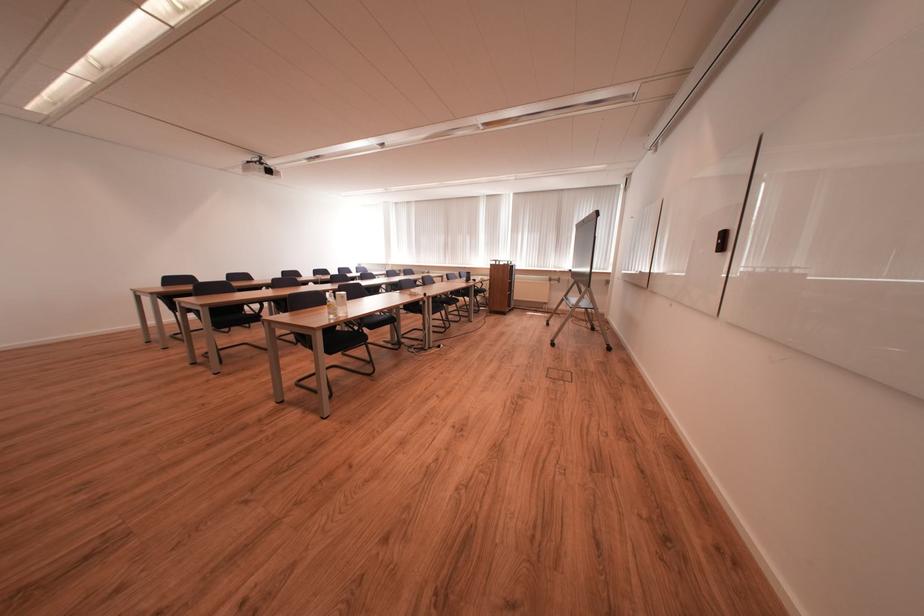
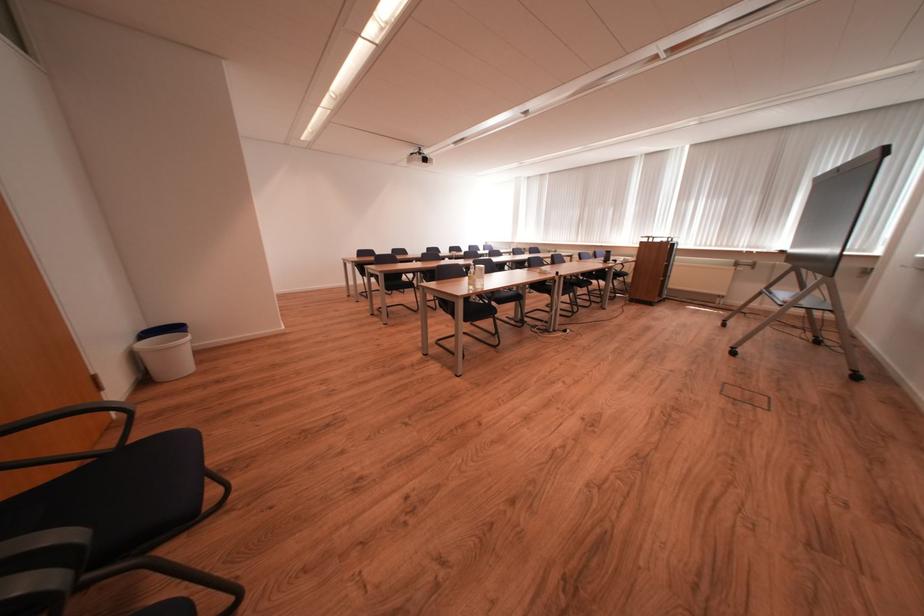
Question: The images are taken continuously from a first-person perspective. In which direction are you moving?

Choices:
 (A) Left
 (B) Right
 (C) Forward
 (D) Backward

Answer: (A)